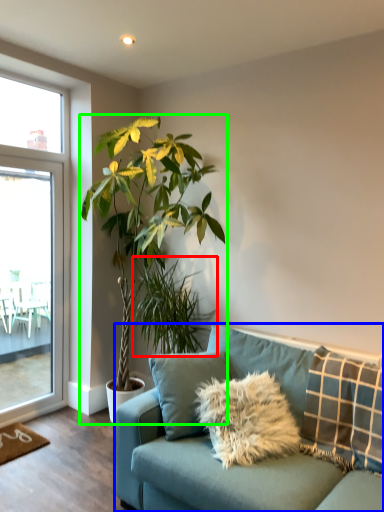
Question: Considering the real-world distances, which object is farthest from houseplant (highlighted by a red box)? studio couch (highlighted by a blue box) or houseplant (highlighted by a green box)?

Choices:
 (A) studio couch
 (B) houseplant

Answer: (A)